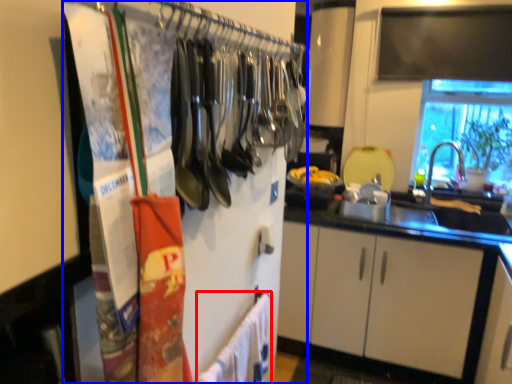
Question: Which point is further to the camera, bath towel (highlighted by a red box) or closet (highlighted by a blue box)?

Choices:
 (A) bath towel
 (B) closet

Answer: (A)